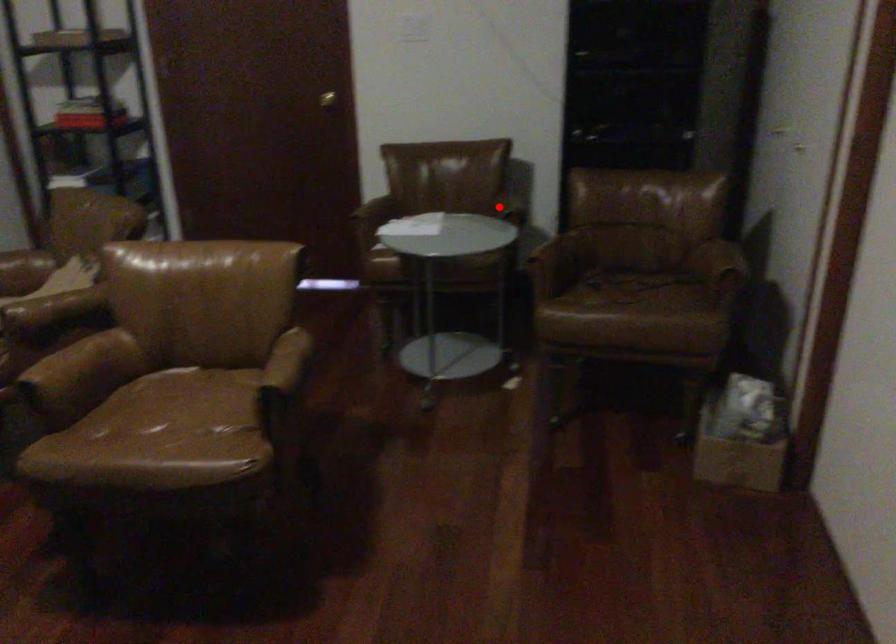
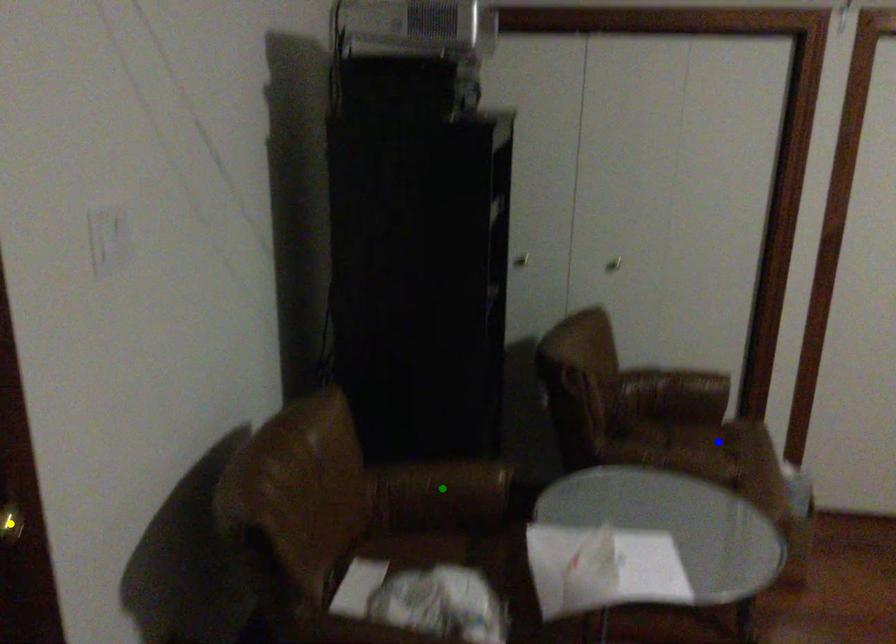
Question: I am providing you with two images of the same scene from different viewpoints. A red point is marked on the first image. You are given multiple points on the second image. Can you choose the point in image 2 that corresponds to the point in image 1?

Choices:
 (A) green point
 (B) yellow point
 (C) blue point

Answer: (A)